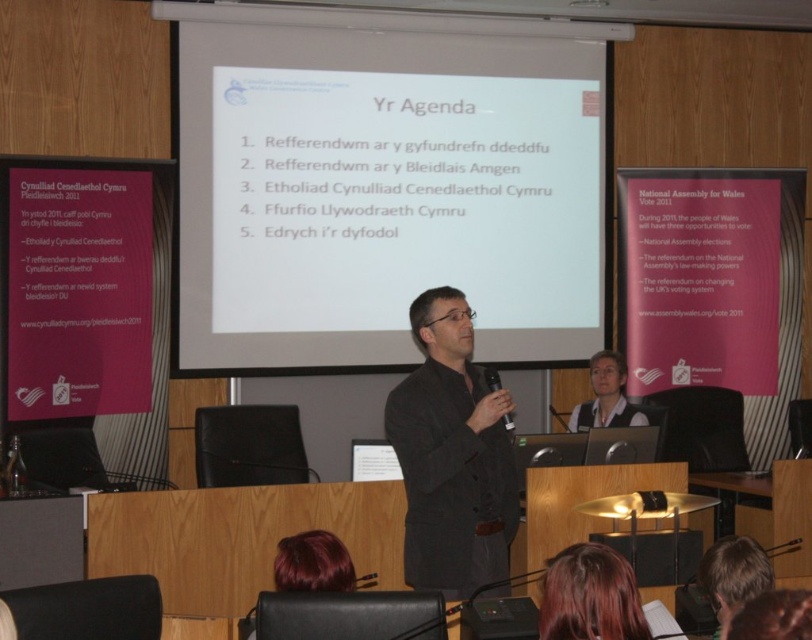
You are an attendee at the presentation and want to take notes about the two speakers. The speakers are the smooth hair at lower center and the smooth brown hair at lower right. Which speaker is positioned lower in the image?

The smooth hair at lower center is positioned lower in the image than the smooth brown hair at lower right.

You are a photographer in a conference room. You need to take a photo of the two people with smooth hair at lower center and smooth brown hair at lower right. The camera you are using has a minimum focus distance of 13 inches. Can you take a clear photo of both of them without moving the camera?

The smooth hair at lower center and smooth brown hair at lower right are 12.95 inches apart from each other, which is less than the camera minimum focus distance of 13 inches. Therefore, the camera cannot focus on both subjects simultaneously, so you cannot take a clear photo of both without moving the camera.